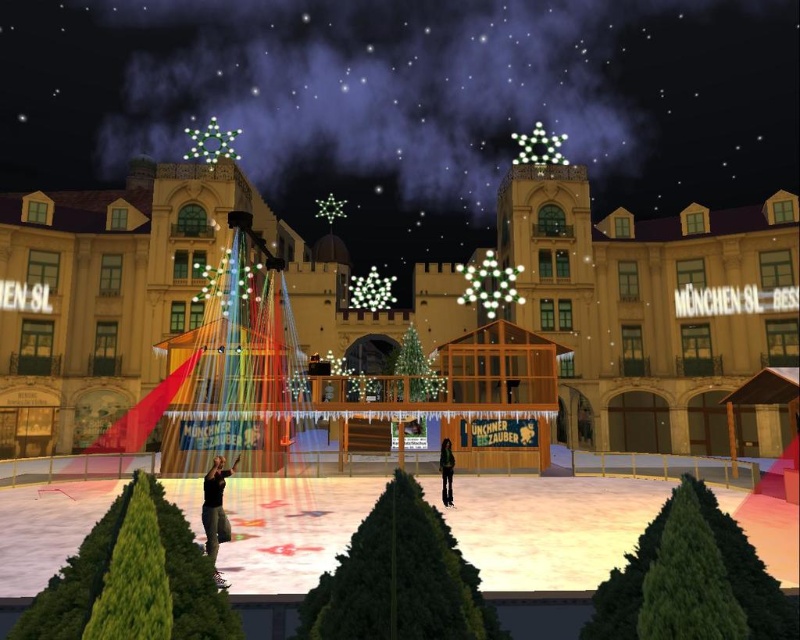
You are an observer standing at the edge of the ice rink in the festive scene. You notice the black leather jacket at lower center and the green fabric pants at center. Which of these items appears bigger in size?

The black leather jacket at lower center appears larger in size than the green fabric pants at center.